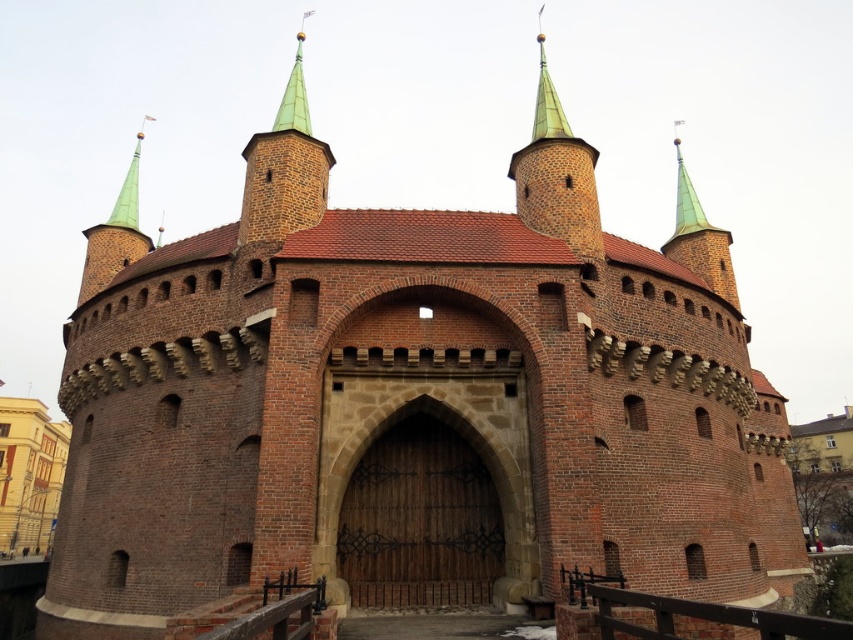
Question: Among these points, which one is farthest from the camera?

Choices:
 (A) pos(300,60)
 (B) pos(286,580)

Answer: (A)

Question: Which object is farther from the camera taking this photo?

Choices:
 (A) green pointed spire at upper center
 (B) black metal/rail at lower center

Answer: (A)

Question: Is black metal/rail at lower center smaller than green pointed spire at upper center?

Choices:
 (A) yes
 (B) no

Answer: (A)

Question: Considering the relative positions of black metal/rail at lower center and green pointed spire at upper center in the image provided, where is black metal/rail at lower center located with respect to green pointed spire at upper center?

Choices:
 (A) below
 (B) above

Answer: (A)

Question: From the image, what is the correct spatial relationship of black metal/rail at lower center in relation to green pointed spire at upper center?

Choices:
 (A) right
 (B) left

Answer: (A)